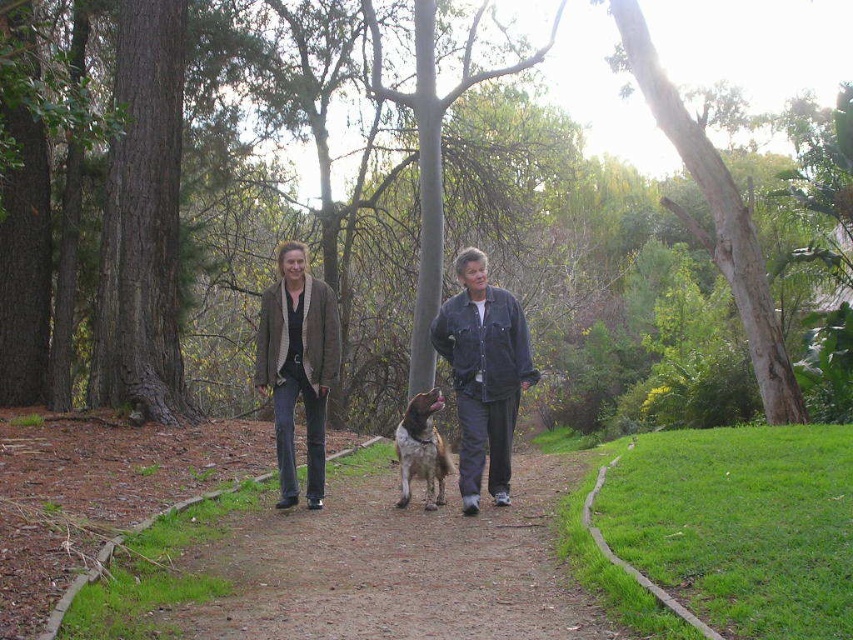
You are standing at the origin point in the park scene. The brown leather jacket at center is located at coordinates 0.572 on the x and 0.351 on the y. If you want to walk directly to the jacket, which direction should you move in terms of x and y coordinates?

To reach the brown leather jacket at center located at coordinates x 0.572 and y 0.351, you should move in the positive x and positive y direction from the origin.

You are standing at the point labeled as point [329,369] and want to walk towards the point labeled as point [315,380]. Which direction should you face to move towards your destination?

To move from point [329,369] to point [315,380], you should face towards the direction of point [315,380], which is behind point [329,369].